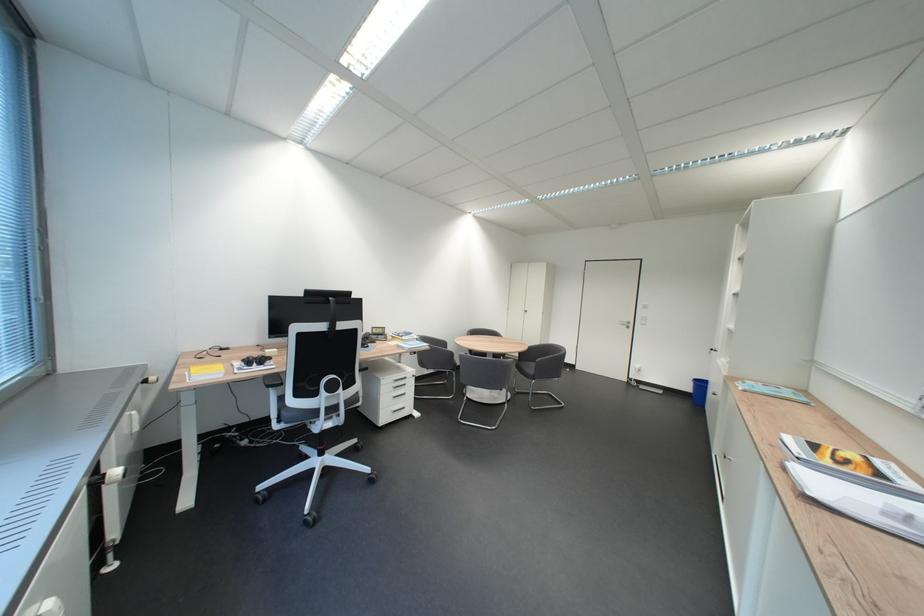
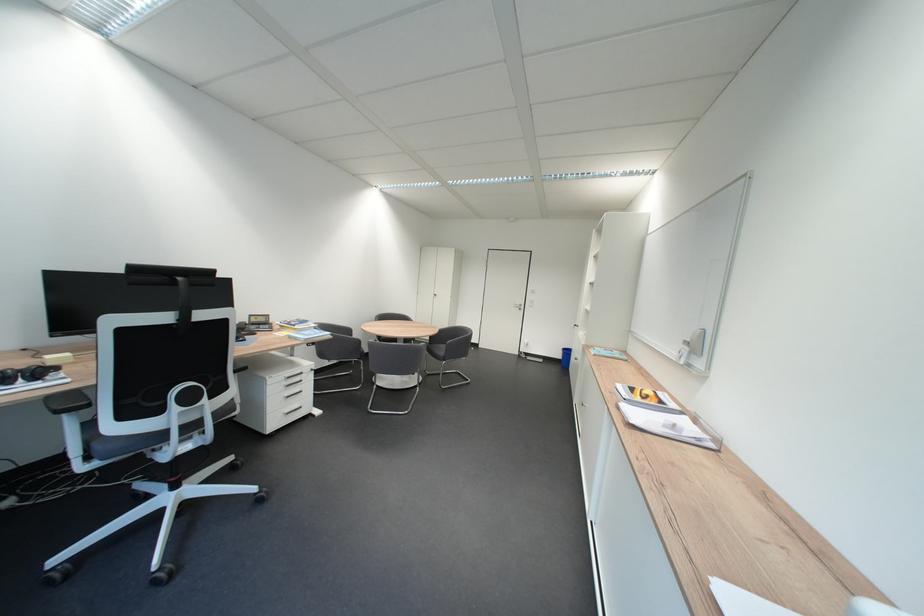
Find the pixel in the second image that matches point (286, 382) in the first image.

(82, 403)